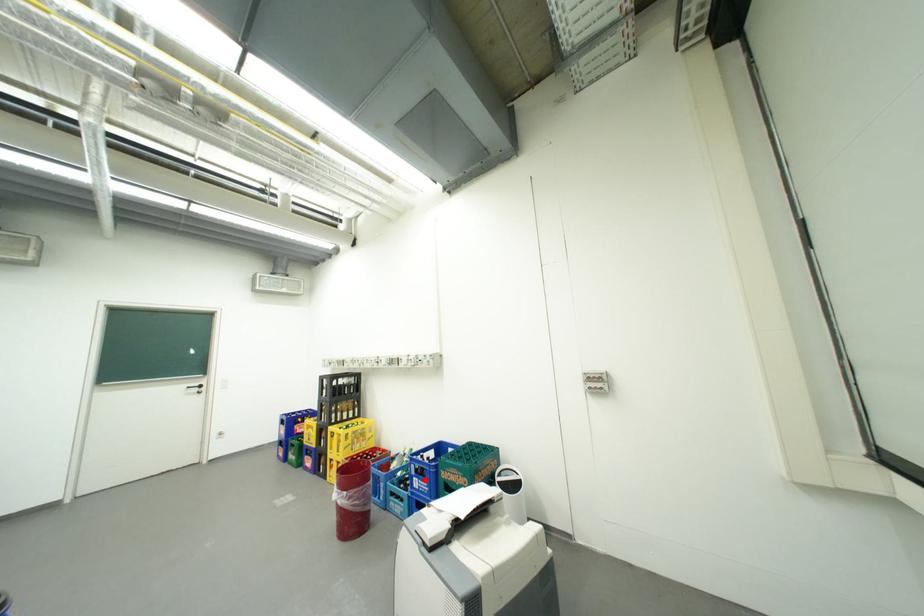
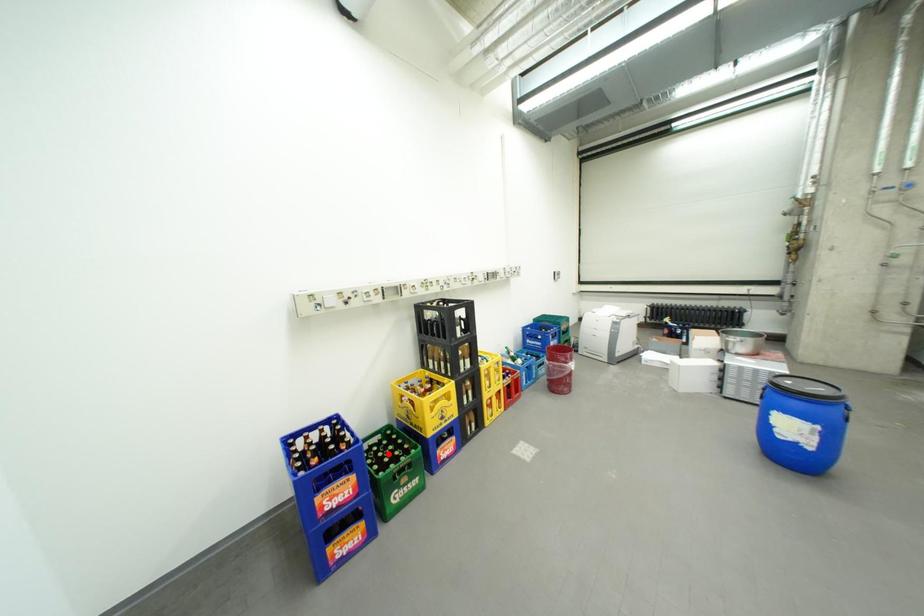
I am providing you with two images of the same scene from different viewpoints. A red point is marked on the first image and another point is marked on the second image. Do the highlighted points in image1 and image2 indicate the same real-world spot?

No